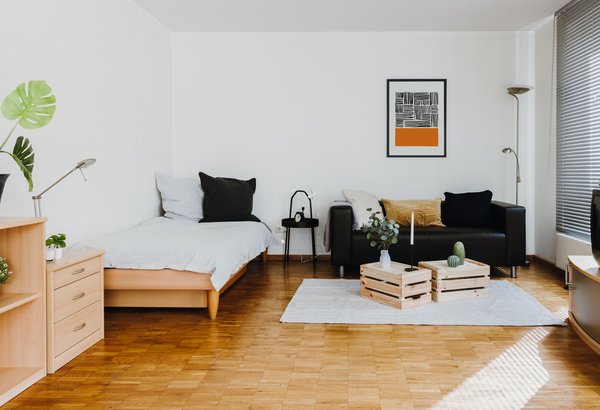
Locate an element on the screen. fake cacti is located at coordinates (453, 258).